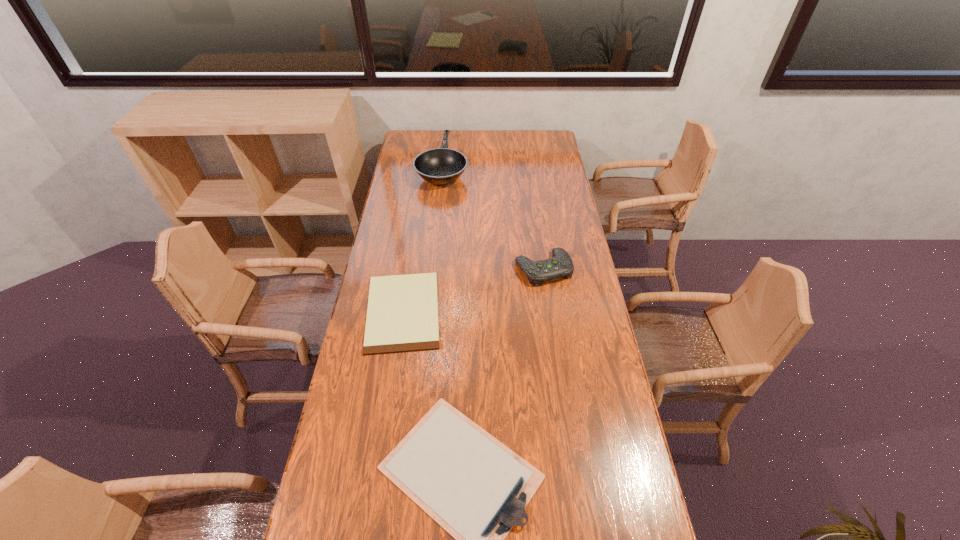
This screenshot has width=960, height=540. Find the location of `free space between the second tallest object and the farthest object`. free space between the second tallest object and the farthest object is located at coordinates (492, 218).

Locate an element on the screen. This screenshot has width=960, height=540. object that stands as the closest to the shortest object is located at coordinates tap(476, 488).

Locate which object is the third closest to the farthest object. Please provide its 2D coordinates. Your answer should be formatted as a tuple, i.e. [(x, y)], where the tuple contains the x and y coordinates of a point satisfying the conditions above.

[(476, 488)]

In order to click on free space that satisfies the following two spatial constraints: 1. on the back side of the frying pan; 2. on the left side of the shortest object in this screenshot , I will do `click(425, 168)`.